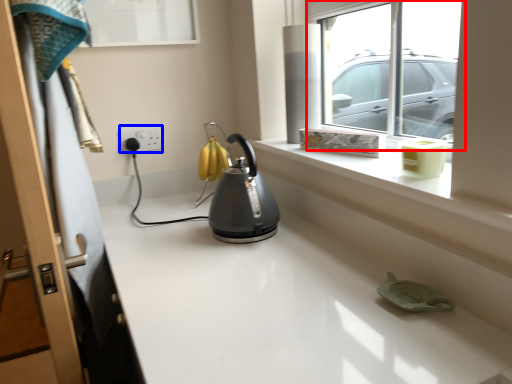
Question: Which object is closer to the camera taking this photo, window (highlighted by a red box) or electric outlet (highlighted by a blue box)?

Choices:
 (A) window
 (B) electric outlet

Answer: (A)